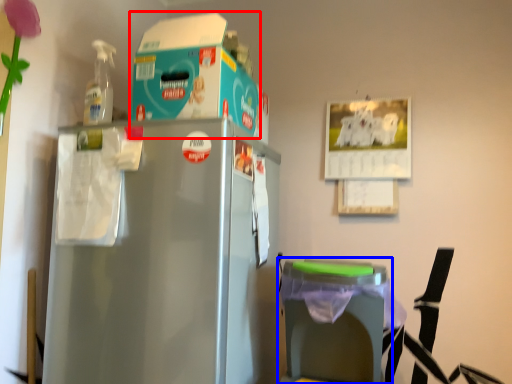
Question: Among these objects, which one is farthest to the camera, storage box (highlighted by a red box) or table (highlighted by a blue box)?

Choices:
 (A) storage box
 (B) table

Answer: (A)